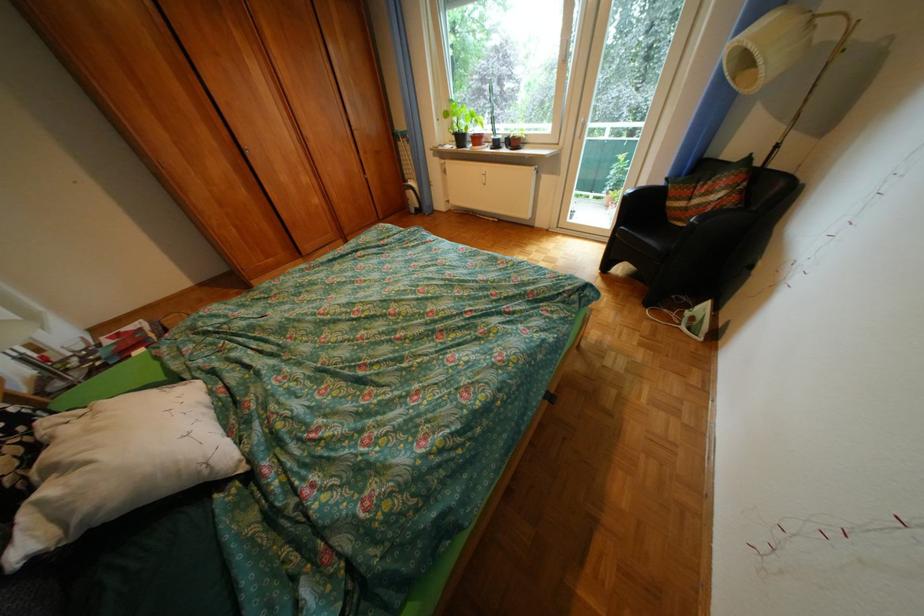
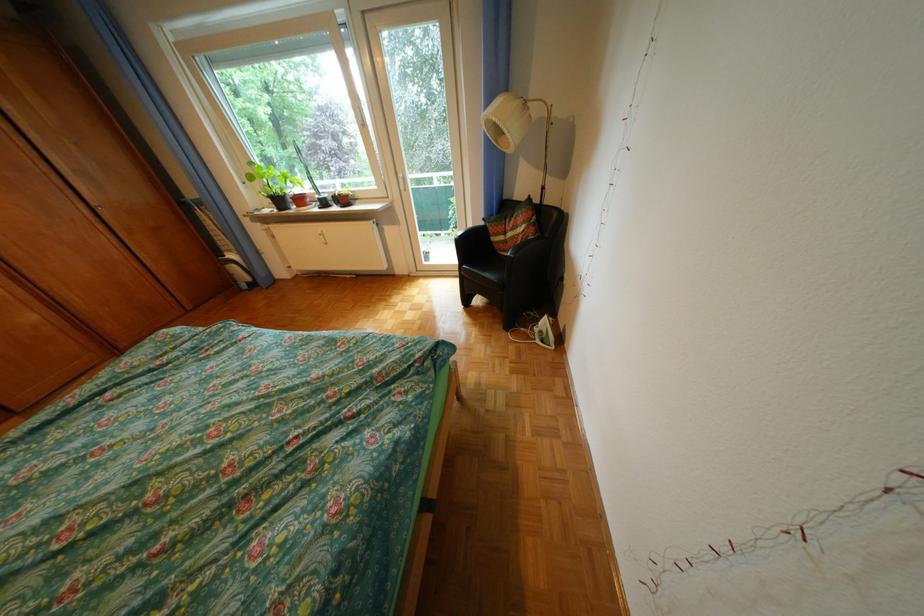
In the second image, find the point that corresponds to pixel 663 241 in the first image.

(502, 276)